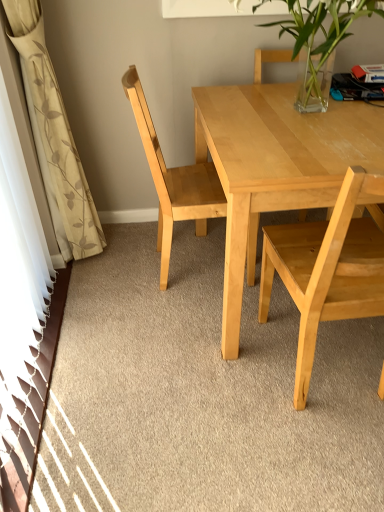
This screenshot has width=384, height=512. What are the coordinates of `vacant area situated below light wood chair at right, marked as the 1th chair in a right-to-left arrangement (from a real-world perspective)` in the screenshot? It's located at (334, 379).